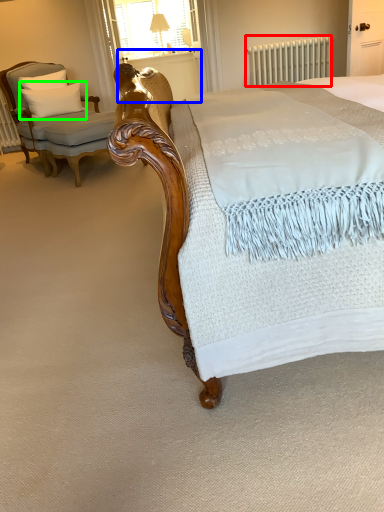
Question: Estimate the real-world distances between objects in this image. Which object is closer to radiator (highlighted by a red box), balustrade (highlighted by a blue box) or pillow (highlighted by a green box)?

Choices:
 (A) balustrade
 (B) pillow

Answer: (A)